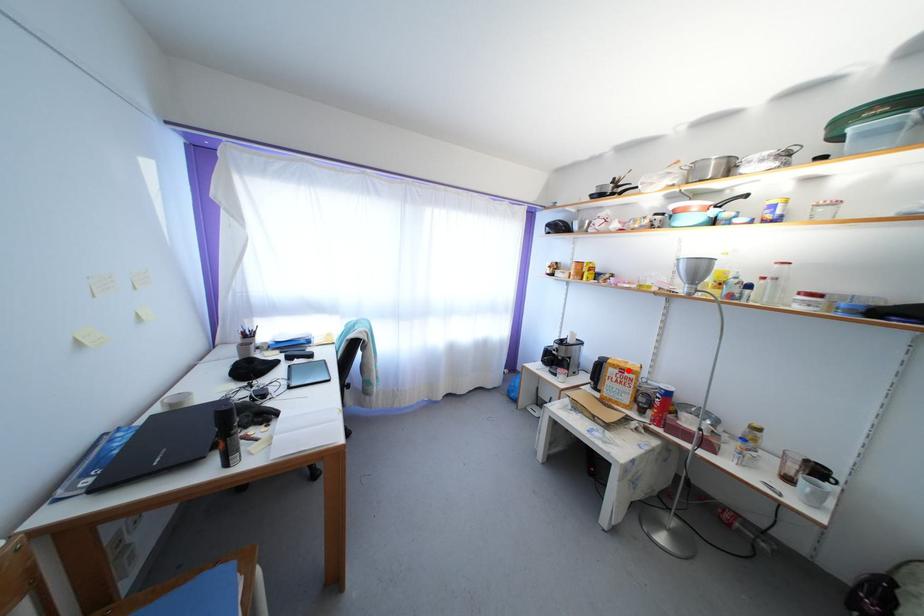
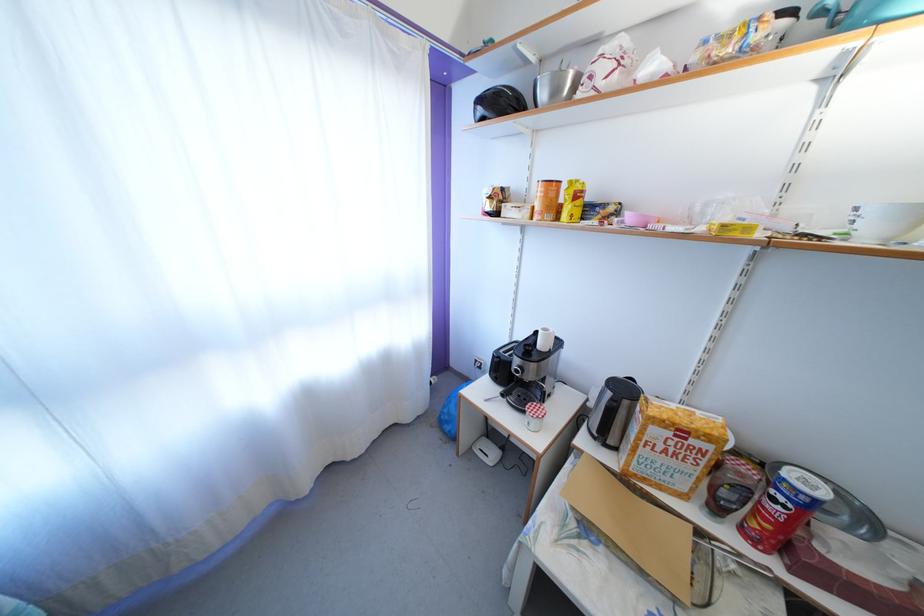
Question: I am providing you with two images of the same scene from different viewpoints. Image1 has a red point marked. In image2, the corresponding 3D location appears at what relative position? Reply with the corresponding letter.

Choices:
 (A) Closer
 (B) Farther

Answer: (B)